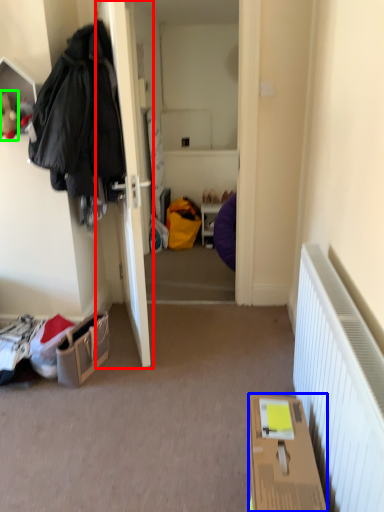
Question: Considering the real-world distances, which object is closest to door (highlighted by a red box)? box (highlighted by a blue box) or toy (highlighted by a green box).

Choices:
 (A) box
 (B) toy

Answer: (B)